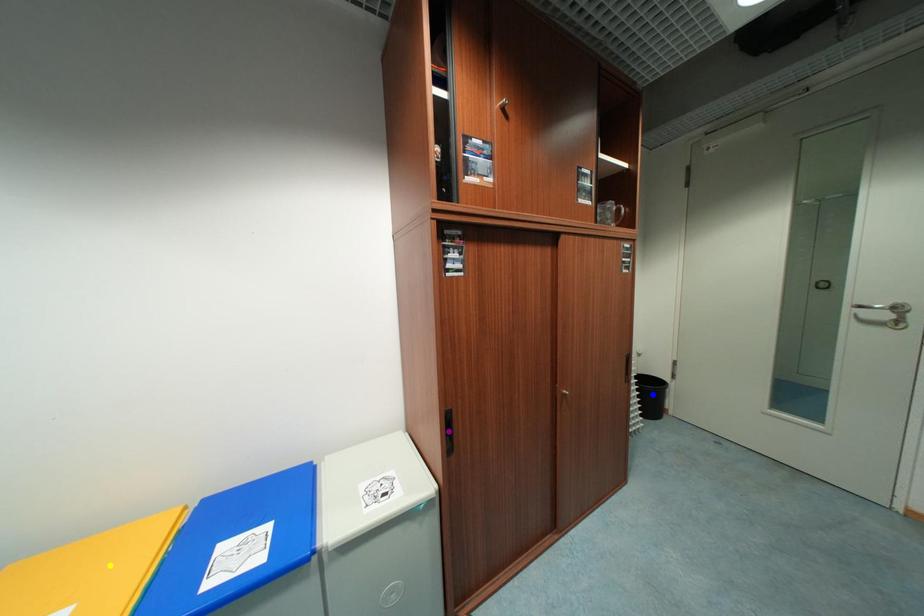
Order these from nearest to farthest:
purple point, yellow point, blue point

yellow point
purple point
blue point